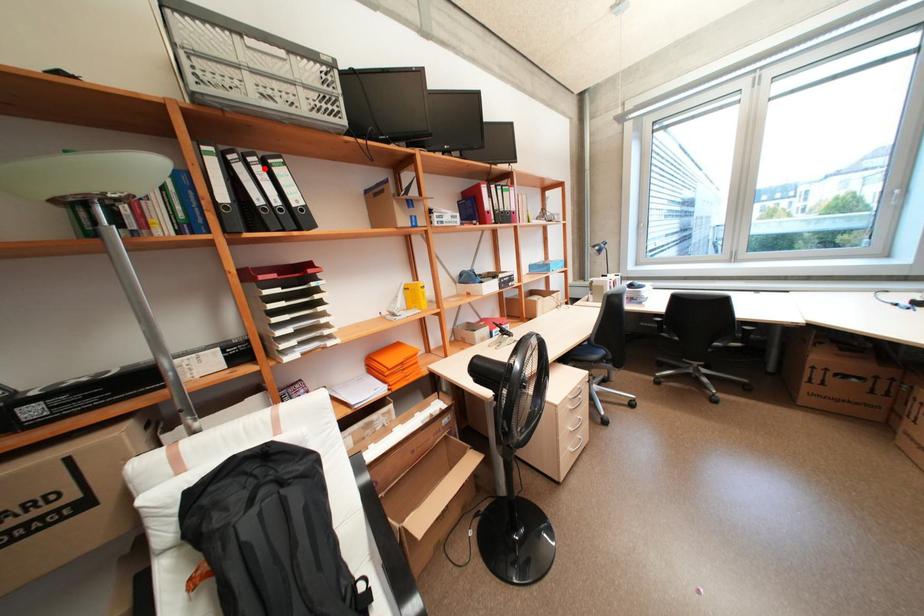
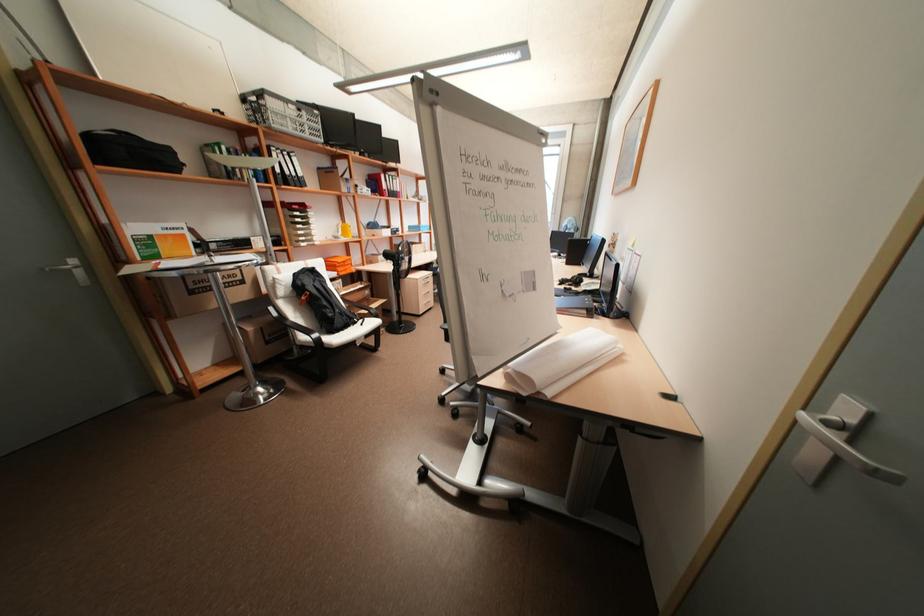
Question: I am providing you with two images of the same scene from different viewpoints. Image1 has a red point marked. In image2, the corresponding 3D location appears at what relative position? Reply with the corresponding letter.

Choices:
 (A) Closer
 (B) Farther

Answer: (A)